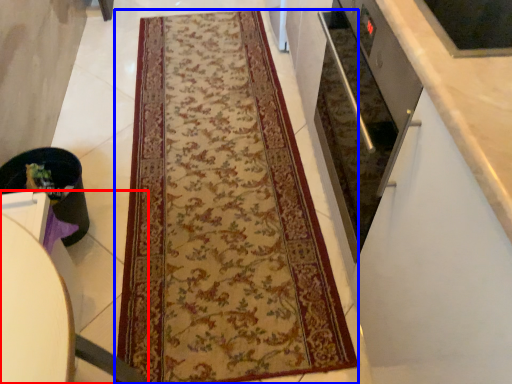
Question: Which of the following is the closest to the observer, furniture (highlighted by a red box) or mat (highlighted by a blue box)?

Choices:
 (A) furniture
 (B) mat

Answer: (A)